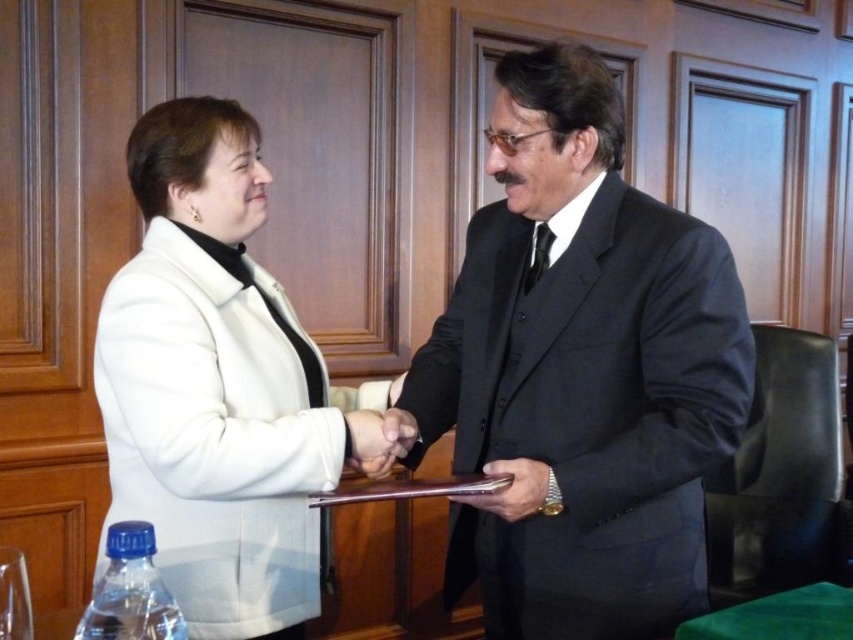
Is point (109, 417) positioned before point (351, 426)?

That is False.

Between white woolen coat at center and smooth skin handshake at center, which one has more height?

white woolen coat at center is taller.

Is point (252, 188) behind point (404, 412)?

Yes, point (252, 188) is behind point (404, 412).

You are a GUI agent. You are given a task and a screenshot of the screen. Output one action in this format:
    pyautogui.click(x=<x>, y=<y>)
    Task: Click on the white woolen coat at center
    
    Given the screenshot: What is the action you would take?
    pyautogui.click(x=218, y=385)

Between white woolen coat at center and leather wallet at center, which one has less height?

leather wallet at center is shorter.

Between white woolen coat at center and leather wallet at center, which one appears on the left side from the viewer's perspective?

white woolen coat at center is more to the left.

Describe the element at coordinates (218, 385) in the screenshot. I see `white woolen coat at center` at that location.

At what (x,y) coordinates should I click in order to perform the action: click on white woolen coat at center. Please return your answer as a coordinate pair (x, y). Looking at the image, I should click on (218, 385).

Is black satin suit at center taller than leather wallet at center?

Indeed, black satin suit at center has a greater height compared to leather wallet at center.

What do you see at coordinates (582, 371) in the screenshot? I see `black satin suit at center` at bounding box center [582, 371].

Who is more forward, (543,60) or (543,500)?

Positioned in front is point (543,500).

Where is `black satin suit at center`? black satin suit at center is located at coordinates (582, 371).